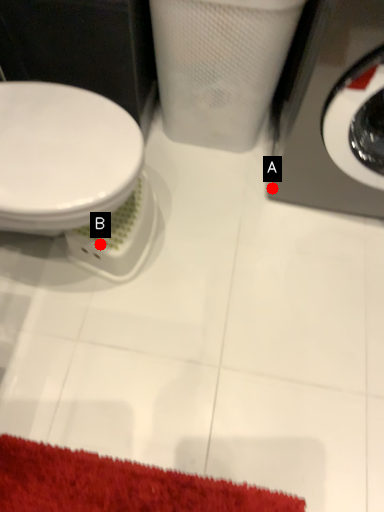
Question: Two points are circled on the image, labeled by A and B beside each circle. Among these points, which one is farthest from the camera?

Choices:
 (A) A is further
 (B) B is further

Answer: (A)